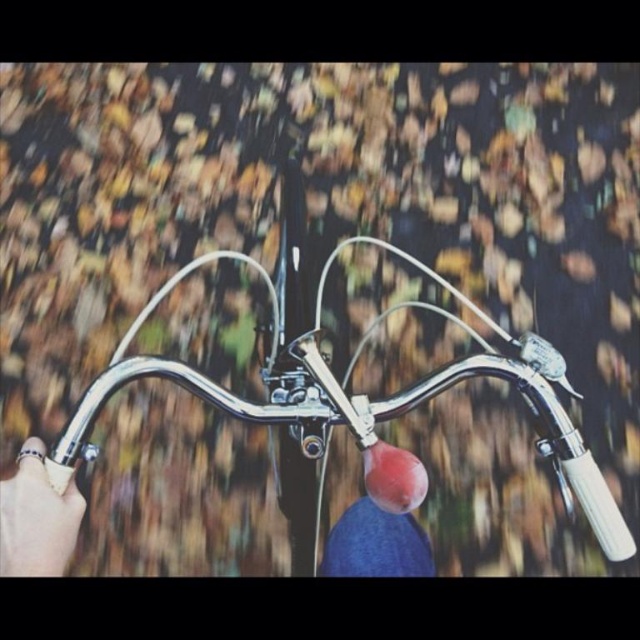
You are a cyclist who wants to know if their handlebars are large enough to hold comfortably. Based on the image, can you compare the size of the polished chrome bicycle handlebars at center and the gold metallic ring at lower left?

The polished chrome bicycle handlebars at center has a larger size compared to the gold metallic ring at lower left, so they are likely large enough to hold comfortably.

You are riding a bicycle and looking at the handlebars. You notice the polished chrome bicycle handlebars at center and the gold metallic ring at lower left. Which object is higher in your field of view?

The polished chrome bicycle handlebars at center is taller than the gold metallic ring at lower left, so it appears higher in your field of view.